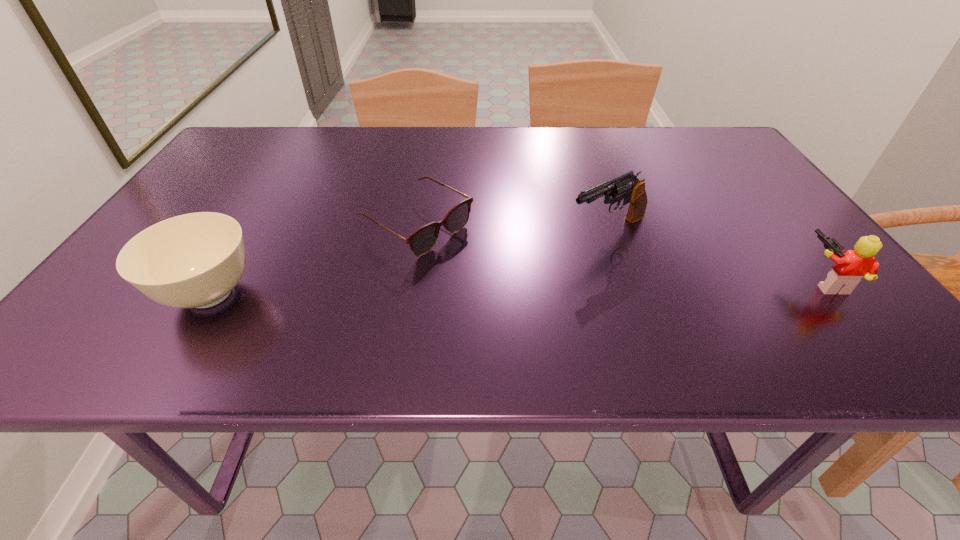
Locate an element on the screen. the leftmost object is located at coordinates (195, 260).

Where is `Lego`? Lego is located at coordinates pyautogui.click(x=849, y=268).

Locate an element on the screen. This screenshot has height=540, width=960. gun is located at coordinates (627, 186).

This screenshot has width=960, height=540. What are the coordinates of `spectacles` in the screenshot? It's located at (421, 241).

This screenshot has width=960, height=540. What are the coordinates of `the second object from left to right` in the screenshot? It's located at (421, 241).

Locate an element on the screen. The height and width of the screenshot is (540, 960). free region located 0.110m on the left of the leftmost object is located at coordinates (103, 294).

Where is `free space located in front of the Lego with the accessory visible`? free space located in front of the Lego with the accessory visible is located at coordinates (655, 281).

You are a GUI agent. You are given a task and a screenshot of the screen. Output one action in this format:
    pyautogui.click(x=<x>, y=<y>)
    Task: Click on the vacant space located in front of the Lego with the accessory visible
    
    Given the screenshot: What is the action you would take?
    pyautogui.click(x=760, y=281)

At what (x,y) coordinates should I click in order to perform the action: click on vacant region located 0.190m in front of the Lego with the accessory visible. Please return your answer as a coordinate pair (x, y). The height and width of the screenshot is (540, 960). Looking at the image, I should click on (709, 281).

Locate an element on the screen. blank space located 0.110m along the barrel of the second object from right to left is located at coordinates (536, 263).